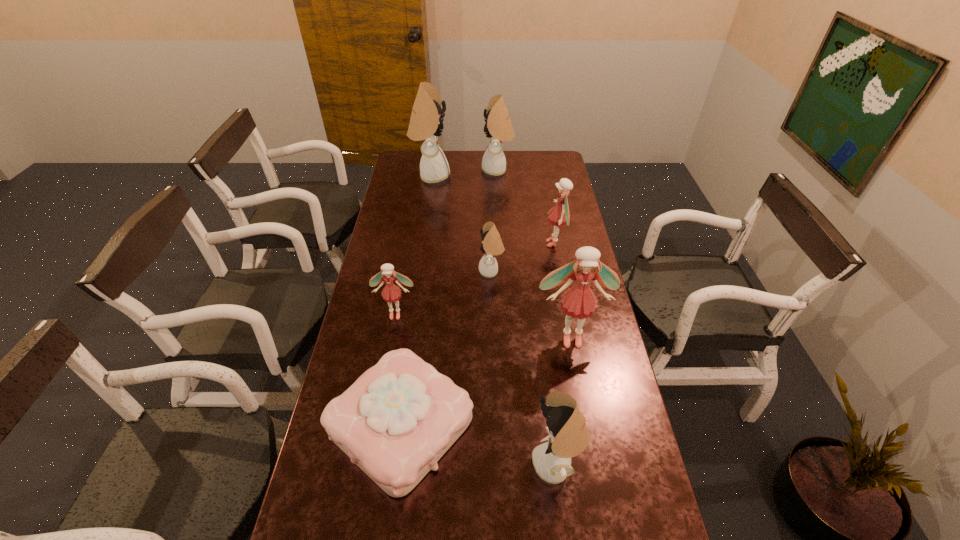
Where is `free space between the second biggest black doll and the shortest object`? The image size is (960, 540). free space between the second biggest black doll and the shortest object is located at coordinates [x=449, y=298].

Image resolution: width=960 pixels, height=540 pixels. What are the coordinates of `unoccupied position between the nearest black doll and the smallest black doll` in the screenshot? It's located at (524, 368).

Locate an element on the screen. This screenshot has width=960, height=540. empty space between the fifth farthest object and the tallest object is located at coordinates (414, 245).

Identify which object is the sixth nearest to the tallest object. Please provide its 2D coordinates. Your answer should be formatted as a tuple, i.e. [(x, y)], where the tuple contains the x and y coordinates of a point satisfying the conditions above.

[(395, 422)]

Identify which object is the fifth nearest to the third biggest black doll. Please provide its 2D coordinates. Your answer should be formatted as a tuple, i.e. [(x, y)], where the tuple contains the x and y coordinates of a point satisfying the conditions above.

[(559, 216)]

Find the location of a particular element. Image resolution: width=960 pixels, height=540 pixels. the fourth closest doll to the second nearest black doll is located at coordinates (426, 123).

Locate which doll is the fifth closest to the second biggest black doll. Please provide its 2D coordinates. Your answer should be formatted as a tuple, i.e. [(x, y)], where the tuple contains the x and y coordinates of a point satisfying the conditions above.

[(579, 301)]

At what (x,y) coordinates should I click in order to perform the action: click on black doll that can be found as the second closest to the second farthest pink doll. Please return your answer as a coordinate pair (x, y). Looking at the image, I should click on (569, 437).

At what (x,y) coordinates should I click in order to perform the action: click on the third closest black doll relative to the second nearest black doll. Please return your answer as a coordinate pair (x, y). Looking at the image, I should click on (569, 437).

Identify the location of the second closest pink doll to the second biggest pink doll. The width and height of the screenshot is (960, 540). (391, 293).